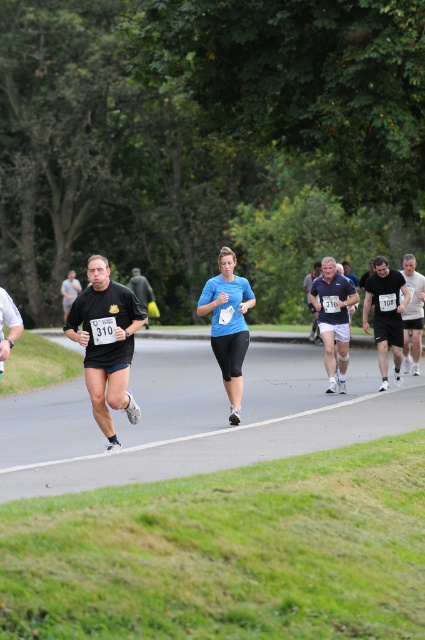
Is point (71, 288) positioned before point (317, 268)?

No, (71, 288) is further to viewer.

Is black matte t-shirt at center wider than dark blue t-shirt at center?

Yes.

Is point (73, 275) behind point (303, 282)?

Yes.

Identify the location of black matte t-shirt at center. Image resolution: width=425 pixels, height=640 pixels. point(68,291).

How far apart are black matte running shirt at center and dark blue t-shirt at center?

A distance of 22.03 feet exists between black matte running shirt at center and dark blue t-shirt at center.

Looking at this image, is black matte running shirt at center thinner than dark blue t-shirt at center?

In fact, black matte running shirt at center might be wider than dark blue t-shirt at center.

In order to click on black matte running shirt at center in this screenshot , I will do `click(141, 288)`.

Is the position of blue fabric shorts at center more distant than that of white matte shirt at center?

No, blue fabric shorts at center is in front of white matte shirt at center.

Identify the location of blue fabric shorts at center. Image resolution: width=425 pixels, height=640 pixels. (334, 320).

Describe the element at coordinates (334, 320) in the screenshot. I see `blue fabric shorts at center` at that location.

Image resolution: width=425 pixels, height=640 pixels. Identify the location of blue fabric shorts at center. (334, 320).